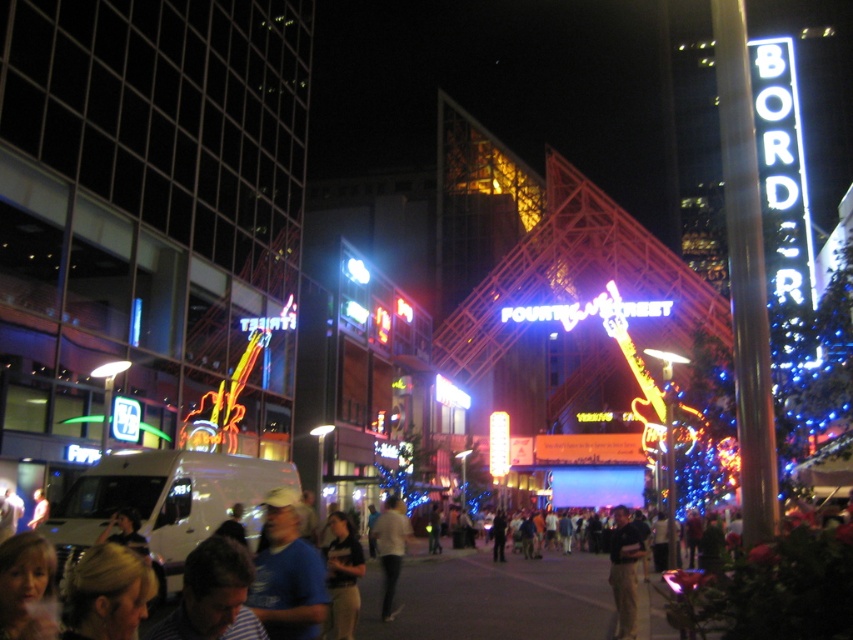
You are standing on the street and see the blue matte shirt at lower center and the light beige pants at center. Which one is positioned more to the left side?

The blue matte shirt at lower center is positioned more to the left side of the light beige pants at center.

You are a photographer trying to capture a group photo of the blue matte shirt at lower center and the dark blue shirt at center. If you want both shirts to appear equally sized in the photo, where should you position the camera relative to them?

To make the blue matte shirt at lower center and the dark blue shirt at center appear equally sized in the photo, you should position the camera closer to the blue matte shirt at lower center since it is narrower than the dark blue shirt at center. This adjustment will help balance their sizes in the frame.